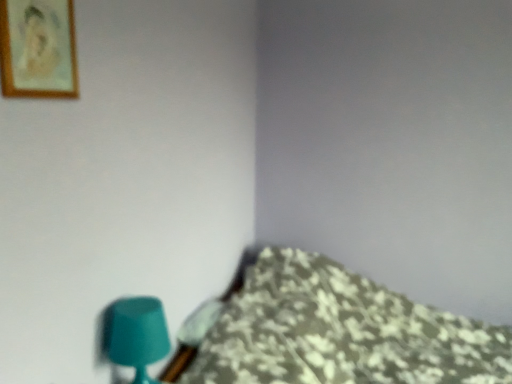
Question: From the image's perspective, is wooden framed portrait at upper left located above or below teal matte table lamp at lower left?

Choices:
 (A) above
 (B) below

Answer: (A)

Question: In terms of width, does wooden framed portrait at upper left look wider or thinner when compared to teal matte table lamp at lower left?

Choices:
 (A) thin
 (B) wide

Answer: (A)

Question: Which is nearer to the floral fabric bedspread at lower right?

Choices:
 (A) teal matte table lamp at lower left
 (B) wooden framed portrait at upper left

Answer: (A)

Question: Considering the real-world distances, which object is closest to the floral fabric bedspread at lower right?

Choices:
 (A) teal matte table lamp at lower left
 (B) wooden framed portrait at upper left

Answer: (A)